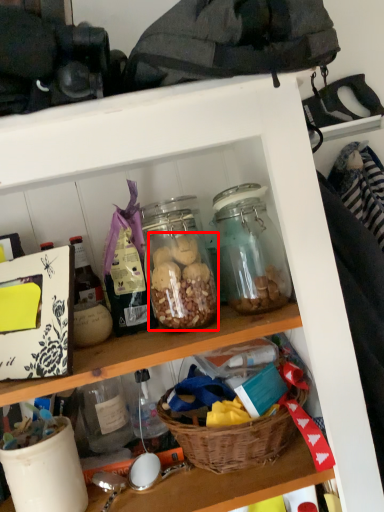
Question: In this image, where is food (annotated by the red box) located relative to basket?

Choices:
 (A) left
 (B) right

Answer: (A)